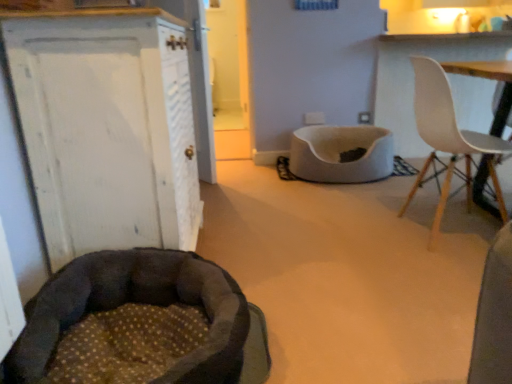
Question: Is white painted wood cabinet at left behind white plastic chair at upper right?

Choices:
 (A) no
 (B) yes

Answer: (A)

Question: Could white plastic chair at upper right be considered to be inside white painted wood cabinet at left?

Choices:
 (A) yes
 (B) no

Answer: (B)

Question: From a real-world perspective, is white painted wood cabinet at left physically below white plastic chair at upper right?

Choices:
 (A) yes
 (B) no

Answer: (B)

Question: Does white painted wood cabinet at left have a lesser height compared to white plastic chair at upper right?

Choices:
 (A) yes
 (B) no

Answer: (B)

Question: Is white painted wood cabinet at left touching white plastic chair at upper right?

Choices:
 (A) no
 (B) yes

Answer: (A)

Question: From the image's perspective, is white plastic chair at upper right above or below white painted wood cabinet at left?

Choices:
 (A) above
 (B) below

Answer: (A)

Question: In the image, is white plastic chair at upper right positioned in front of or behind white painted wood cabinet at left?

Choices:
 (A) front
 (B) behind

Answer: (B)

Question: From a real-world perspective, is white plastic chair at upper right physically located above or below white painted wood cabinet at left?

Choices:
 (A) below
 (B) above

Answer: (A)

Question: Does point (501, 216) appear closer or farther from the camera than point (113, 233)?

Choices:
 (A) farther
 (B) closer

Answer: (B)

Question: Considering their positions, is white soft pet bed at center located in front of or behind dark brown plush dog bed at lower left?

Choices:
 (A) front
 (B) behind

Answer: (B)

Question: Considering the positions of white soft pet bed at center and dark brown plush dog bed at lower left in the image, is white soft pet bed at center taller or shorter than dark brown plush dog bed at lower left?

Choices:
 (A) short
 (B) tall

Answer: (B)

Question: Is point (325, 130) closer or farther from the camera than point (140, 347)?

Choices:
 (A) closer
 (B) farther

Answer: (B)

Question: Is white soft pet bed at center inside or outside of dark brown plush dog bed at lower left?

Choices:
 (A) inside
 (B) outside

Answer: (B)

Question: Is dark brown plush dog bed at lower left inside or outside of white painted wood cabinet at left?

Choices:
 (A) outside
 (B) inside

Answer: (A)

Question: From a real-world perspective, is dark brown plush dog bed at lower left physically located above or below white painted wood cabinet at left?

Choices:
 (A) above
 (B) below

Answer: (B)